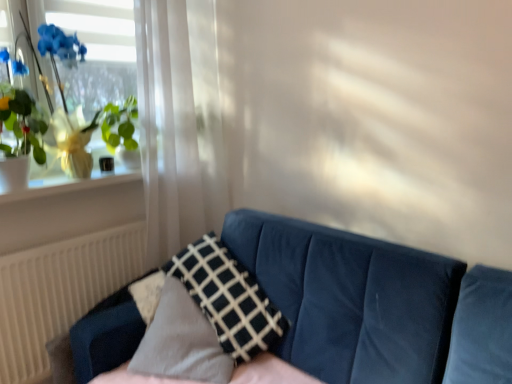
This screenshot has width=512, height=384. What do you see at coordinates (180, 123) in the screenshot? I see `white sheer curtain at left` at bounding box center [180, 123].

At what (x,y) coordinates should I click in order to perform the action: click on white glossy window sill at upper left. Please return your answer as a coordinate pair (x, y). The image size is (512, 384). Looking at the image, I should click on (70, 184).

I want to click on white sheer curtain at left, so click(180, 123).

Which of these two, green leafy plant at left or white sheer curtain at left, stands taller?

white sheer curtain at left.

Can you confirm if green leafy plant at left is positioned to the left of white sheer curtain at left?

Correct, you'll find green leafy plant at left to the left of white sheer curtain at left.

Does point (71, 152) lie behind point (153, 147)?

No, it is in front of (153, 147).

From the image's perspective, is green leafy plant at left located above or below white sheer curtain at left?

Based on their image positions, green leafy plant at left is located above white sheer curtain at left.

Can you tell me how much white sheer curtain at left and green leafy plant at left differ in facing direction?

0.212 degrees.

Is white sheer curtain at left wider or thinner than green leafy plant at left?

Clearly, white sheer curtain at left has more width compared to green leafy plant at left.

In the image, is white sheer curtain at left positioned in front of or behind green leafy plant at left?

white sheer curtain at left is behind green leafy plant at left.

From a real-world perspective, between velvet blue couch at center and green leafy plant at left, who is vertically lower?

velvet blue couch at center is physically lower.

Are velvet blue couch at center and green leafy plant at left beside each other?

velvet blue couch at center and green leafy plant at left are not in contact.

Which is behind, point (111, 316) or point (66, 128)?

The point (66, 128) is behind.

Can you tell me how much velvet blue couch at center and green leafy plant at left differ in facing direction?

There is a 90.1-degree angle between the facing directions of velvet blue couch at center and green leafy plant at left.

Considering the points (70, 283) and (205, 245), which point is in front, point (70, 283) or point (205, 245)?

The point (205, 245) is closer to the camera.

Which of these two, white textured radiator at lower left or dark blue fabric pillow at center, is thinner?

With smaller width is white textured radiator at lower left.

Does white textured radiator at lower left have a smaller size compared to dark blue fabric pillow at center?

Yes, white textured radiator at lower left is smaller than dark blue fabric pillow at center.

From a real-world perspective, who is located higher, white textured radiator at lower left or dark blue fabric pillow at center?

dark blue fabric pillow at center.

From a real-world perspective, between white textured radiator at lower left and green leafy plant at left, who is vertically higher?

In real-world perspective, green leafy plant at left is above.

Considering their positions, is white textured radiator at lower left located in front of or behind green leafy plant at left?

In the image, white textured radiator at lower left appears in front of green leafy plant at left.

Is point (22, 360) closer to viewer compared to point (58, 143)?

That is False.

This screenshot has width=512, height=384. I want to click on radiator that is in front of the green leafy plant at left, so click(x=59, y=292).

From a real-world perspective, is white sheer curtain at left beneath white textured radiator at lower left?

Actually, white sheer curtain at left is physically above white textured radiator at lower left in the real world.

Locate an element on the screen. radiator that appears below the white sheer curtain at left (from a real-world perspective) is located at coordinates (59, 292).

Would you consider white sheer curtain at left to be distant from white textured radiator at lower left?

That's not correct — white sheer curtain at left is a little close to white textured radiator at lower left.

From the image's perspective, is white glossy window sill at upper left on velvet blue couch at center?

Indeed, from the image's perspective, white glossy window sill at upper left is shown above velvet blue couch at center.

Is point (48, 177) closer to viewer compared to point (347, 314)?

No, it is behind (347, 314).

Who is shorter, white glossy window sill at upper left or velvet blue couch at center?

white glossy window sill at upper left.

Considering the sizes of objects white glossy window sill at upper left and velvet blue couch at center in the image provided, who is thinner, white glossy window sill at upper left or velvet blue couch at center?

white glossy window sill at upper left.

Where is `houseplant above the white sheer curtain at left (from the image's perspective)`? houseplant above the white sheer curtain at left (from the image's perspective) is located at coordinates click(x=78, y=111).

Find the location of a particular element. This screenshot has width=512, height=384. curtain below the green leafy plant at left (from a real-world perspective) is located at coordinates (180, 123).

Considering their positions, is velvet blue couch at center positioned closer to white sheer curtain at left than green leafy plant at left?

green leafy plant at left is positioned closer to the anchor white sheer curtain at left.

Considering their positions, is white sheer curtain at left positioned further to green leafy plant at left than dark blue fabric pillow at center?

The object further to green leafy plant at left is dark blue fabric pillow at center.

Estimate the real-world distances between objects in this image. Which object is further from white sheer curtain at left, white glossy window sill at upper left or velvet blue couch at center?

velvet blue couch at center lies further to white sheer curtain at left than the other object.

Which object lies further to the anchor point dark blue fabric pillow at center, white textured radiator at lower left or green leafy plant at left?

green leafy plant at left is further to dark blue fabric pillow at center.

From the image, which object appears to be farther from white textured radiator at lower left, green leafy plant at left or dark blue fabric pillow at center?

dark blue fabric pillow at center is positioned further to the anchor white textured radiator at lower left.

When comparing their distances from green leafy plant at left, does white textured radiator at lower left or white glossy window sill at upper left seem closer?

Among the two, white glossy window sill at upper left is located nearer to green leafy plant at left.

Considering their positions, is green leafy plant at left positioned further to white glossy window sill at upper left than white textured radiator at lower left?

Based on the image, white textured radiator at lower left appears to be further to white glossy window sill at upper left.

From the image, which object appears to be nearer to green leafy plant at left, white sheer curtain at left or white glossy window sill at upper left?

white glossy window sill at upper left.

You are a GUI agent. You are given a task and a screenshot of the screen. Output one action in this format:
    pyautogui.click(x=<x>, y=<y>)
    Task: Click on the window sill between white sheer curtain at left and dark blue fabric pillow at center from top to bottom
    
    Given the screenshot: What is the action you would take?
    pyautogui.click(x=70, y=184)

I want to click on houseplant between velvet blue couch at center and white sheer curtain at left from front to back, so click(x=78, y=111).

At what (x,y) coordinates should I click in order to perform the action: click on window sill between green leafy plant at left and dark blue fabric pillow at center in the vertical direction. Please return your answer as a coordinate pair (x, y). This screenshot has height=384, width=512. Looking at the image, I should click on (70, 184).

Where is `pillow positioned between velvet blue couch at center and white textured radiator at lower left from near to far`? Image resolution: width=512 pixels, height=384 pixels. pillow positioned between velvet blue couch at center and white textured radiator at lower left from near to far is located at coordinates (228, 298).